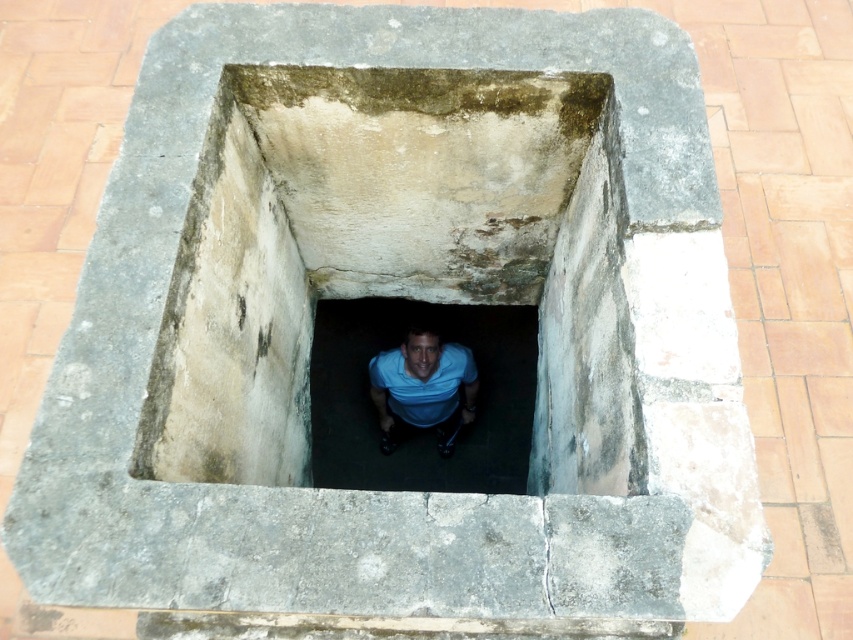
Image resolution: width=853 pixels, height=640 pixels. I want to click on blue fabric man at center, so click(x=433, y=422).

Can you confirm if blue fabric man at center is positioned above blue matte shirt at center?

No, blue fabric man at center is not above blue matte shirt at center.

Between point (355, 323) and point (473, 372), which one is positioned behind?

The point (355, 323) is behind.

The width and height of the screenshot is (853, 640). What are the coordinates of `blue fabric man at center` in the screenshot? It's located at (433, 422).

Is concrete well at center bigger than blue matte shirt at center?

Correct, concrete well at center is larger in size than blue matte shirt at center.

Measure the distance from concrete well at center to blue matte shirt at center.

concrete well at center and blue matte shirt at center are 1.15 meters apart.

At what (x,y) coordinates should I click in order to perform the action: click on concrete well at center. Please return your answer as a coordinate pair (x, y). Image resolution: width=853 pixels, height=640 pixels. Looking at the image, I should click on (392, 257).

How much distance is there between concrete well at center and blue fabric man at center?

A distance of 1.88 meters exists between concrete well at center and blue fabric man at center.

Is concrete well at center positioned behind blue fabric man at center?

That is False.

Find the location of a particular element. This screenshot has width=853, height=640. concrete well at center is located at coordinates (392, 257).